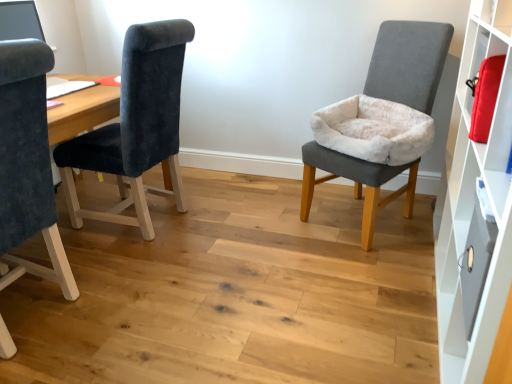
What do you see at coordinates (476, 264) in the screenshot? I see `metallic gray drawer at right` at bounding box center [476, 264].

I want to click on velvet dark blue chair at left, the third chair viewed from the right, so click(27, 164).

What do you see at coordinates (473, 201) in the screenshot?
I see `white matte cabinet at right` at bounding box center [473, 201].

The width and height of the screenshot is (512, 384). What do you see at coordinates (408, 62) in the screenshot?
I see `velvet gray chair at right, the first chair viewed from the right` at bounding box center [408, 62].

Measure the distance between point [429,83] and camera.

7.08 feet.

What is the approximate width of velvet dark blue chair at left, the second chair positioned from the left?

26.82 inches.

The height and width of the screenshot is (384, 512). In order to click on metallic gray drawer at right in this screenshot , I will do `click(476, 264)`.

Who is bigger, velvet gray chair at right, acting as the third chair starting from the left, or white matte cabinet at right?

white matte cabinet at right is bigger.

Can you tell me how much velvet gray chair at right, acting as the third chair starting from the left, and white matte cabinet at right differ in facing direction?

58 degrees.

Would you say white matte cabinet at right is part of velvet gray chair at right, acting as the third chair starting from the left,'s contents?

No, velvet gray chair at right, acting as the third chair starting from the left, does not contain white matte cabinet at right.

Is velvet dark blue chair at left, the third chair viewed from the right, next to velvet gray chair at right, the first chair viewed from the right?

velvet dark blue chair at left, the third chair viewed from the right, and velvet gray chair at right, the first chair viewed from the right, are not in contact.

Considering the points (7, 251) and (423, 53), which point is behind, point (7, 251) or point (423, 53)?

The point (423, 53) is behind.

Can you tell me how much velvet dark blue chair at left, which is the 1th chair from left to right, and velvet gray chair at right, the first chair viewed from the right, differ in facing direction?

The angle between the facing direction of velvet dark blue chair at left, which is the 1th chair from left to right, and the facing direction of velvet gray chair at right, the first chair viewed from the right, is 59.1 degrees.

Can you confirm if velvet dark blue chair at left, the third chair viewed from the right, is smaller than velvet gray chair at right, acting as the third chair starting from the left?

Indeed, velvet dark blue chair at left, the third chair viewed from the right, has a smaller size compared to velvet gray chair at right, acting as the third chair starting from the left.

Locate an element on the screen. drawer in front of the velvet dark blue chair at left, the second chair positioned from the left is located at coordinates (476, 264).

Is metallic gray drawer at right at the right side of velvet dark blue chair at left, positioned as the second chair in right-to-left order?

Yes.

Considering the sizes of metallic gray drawer at right and velvet dark blue chair at left, positioned as the second chair in right-to-left order, in the image, is metallic gray drawer at right taller or shorter than velvet dark blue chair at left, positioned as the second chair in right-to-left order,?

Considering their sizes, metallic gray drawer at right has less height than velvet dark blue chair at left, positioned as the second chair in right-to-left order.

Considering the sizes of objects metallic gray drawer at right and velvet dark blue chair at left, the second chair positioned from the left, in the image provided, who is wider, metallic gray drawer at right or velvet dark blue chair at left, the second chair positioned from the left,?

Wider between the two is velvet dark blue chair at left, the second chair positioned from the left.

Based on the photo, considering the sizes of objects velvet dark blue chair at left, which is the 1th chair from left to right, and velvet dark blue chair at left, positioned as the second chair in right-to-left order, in the image provided, who is smaller, velvet dark blue chair at left, which is the 1th chair from left to right, or velvet dark blue chair at left, positioned as the second chair in right-to-left order,?

velvet dark blue chair at left, positioned as the second chair in right-to-left order.

Is velvet dark blue chair at left, the third chair viewed from the right, not close to velvet dark blue chair at left, the second chair positioned from the left?

No, velvet dark blue chair at left, the third chair viewed from the right, is not far away from velvet dark blue chair at left, the second chair positioned from the left.

Does point (31, 85) come farther from viewer compared to point (161, 157)?

No, (31, 85) is in front of (161, 157).

Which object is closer to the camera taking this photo, velvet dark blue chair at left, the third chair viewed from the right, or velvet dark blue chair at left, the second chair positioned from the left?

velvet dark blue chair at left, the third chair viewed from the right.

The height and width of the screenshot is (384, 512). What are the coordinates of `chair on the left of velvet dark blue chair at left, the second chair positioned from the left` in the screenshot? It's located at (27, 164).

Is velvet dark blue chair at left, the second chair positioned from the left, in contact with velvet dark blue chair at left, which is the 1th chair from left to right?

No.

Is velvet dark blue chair at left, which is the 1th chair from left to right, at the back of velvet dark blue chair at left, positioned as the second chair in right-to-left order?

That's not correct — velvet dark blue chair at left, positioned as the second chair in right-to-left order, is not looking away from velvet dark blue chair at left, which is the 1th chair from left to right.

Measure the distance between velvet dark blue chair at left, the second chair positioned from the left, and velvet dark blue chair at left, the third chair viewed from the right.

They are 22.84 inches apart.

Considering the positions of objects velvet gray chair at right, acting as the third chair starting from the left, and velvet dark blue chair at left, the third chair viewed from the right, in the image provided, who is in front, velvet gray chair at right, acting as the third chair starting from the left, or velvet dark blue chair at left, the third chair viewed from the right,?

velvet dark blue chair at left, the third chair viewed from the right, is closer to the camera.

Considering the relative sizes of velvet gray chair at right, acting as the third chair starting from the left, and velvet dark blue chair at left, the third chair viewed from the right, in the image provided, is velvet gray chair at right, acting as the third chair starting from the left, taller than velvet dark blue chair at left, the third chair viewed from the right,?

Incorrect, the height of velvet gray chair at right, acting as the third chair starting from the left, is not larger of that of velvet dark blue chair at left, the third chair viewed from the right.

Is velvet gray chair at right, the first chair viewed from the right, touching velvet dark blue chair at left, the third chair viewed from the right?

No, velvet gray chair at right, the first chair viewed from the right, is not with velvet dark blue chair at left, the third chair viewed from the right.

Looking at this image, between velvet gray chair at right, acting as the third chair starting from the left, and velvet dark blue chair at left, the third chair viewed from the right, which one has larger size?

With larger size is velvet gray chair at right, acting as the third chair starting from the left.

Is velvet dark blue chair at left, the second chair positioned from the left, beside metallic gray drawer at right?

velvet dark blue chair at left, the second chair positioned from the left, is not next to metallic gray drawer at right, and they're not touching.

Does velvet dark blue chair at left, the second chair positioned from the left, turn towards metallic gray drawer at right?

No, velvet dark blue chair at left, the second chair positioned from the left, is not oriented towards metallic gray drawer at right.

Considering the sizes of velvet dark blue chair at left, the second chair positioned from the left, and metallic gray drawer at right in the image, is velvet dark blue chair at left, the second chair positioned from the left, wider or thinner than metallic gray drawer at right?

In the image, velvet dark blue chair at left, the second chair positioned from the left, appears to be wider than metallic gray drawer at right.

Measure the distance from velvet dark blue chair at left, positioned as the second chair in right-to-left order, to metallic gray drawer at right.

velvet dark blue chair at left, positioned as the second chair in right-to-left order, and metallic gray drawer at right are 5.39 feet apart from each other.

Identify the location of cabinet in front of the velvet gray chair at right, acting as the third chair starting from the left. The width and height of the screenshot is (512, 384). (473, 201).

Identify the location of chair below the velvet gray chair at right, the first chair viewed from the right (from the image's perspective). (27, 164).

Looking at the image, which one is located closer to velvet gray chair at right, the first chair viewed from the right, velvet dark blue chair at left, the third chair viewed from the right, or metallic gray drawer at right?

metallic gray drawer at right.

From the image, which object appears to be nearer to velvet dark blue chair at left, which is the 1th chair from left to right, velvet dark blue chair at left, the second chair positioned from the left, or metallic gray drawer at right?

velvet dark blue chair at left, the second chair positioned from the left.

Estimate the real-world distances between objects in this image. Which object is further from velvet dark blue chair at left, the third chair viewed from the right, white matte cabinet at right or velvet gray chair at right, acting as the third chair starting from the left?

Among the two, velvet gray chair at right, acting as the third chair starting from the left, is located further to velvet dark blue chair at left, the third chair viewed from the right.

Which object lies nearer to the anchor point white matte cabinet at right, metallic gray drawer at right or velvet gray chair at right, acting as the third chair starting from the left?

The object closer to white matte cabinet at right is metallic gray drawer at right.

Considering their positions, is velvet gray chair at right, acting as the third chair starting from the left, positioned further to white matte cabinet at right than velvet dark blue chair at left, positioned as the second chair in right-to-left order?

velvet dark blue chair at left, positioned as the second chair in right-to-left order, is positioned further to the anchor white matte cabinet at right.

When comparing their distances from white matte cabinet at right, does velvet dark blue chair at left, which is the 1th chair from left to right, or velvet gray chair at right, acting as the third chair starting from the left, seem further?

velvet dark blue chair at left, which is the 1th chair from left to right, is further to white matte cabinet at right.

Which object lies nearer to the anchor point velvet dark blue chair at left, positioned as the second chair in right-to-left order, velvet dark blue chair at left, the third chair viewed from the right, or white matte cabinet at right?

velvet dark blue chair at left, the third chair viewed from the right, is positioned closer to the anchor velvet dark blue chair at left, positioned as the second chair in right-to-left order.

When comparing their distances from white matte cabinet at right, does velvet gray chair at right, the first chair viewed from the right, or metallic gray drawer at right seem further?

The object further to white matte cabinet at right is velvet gray chair at right, the first chair viewed from the right.

Locate an element on the screen. The width and height of the screenshot is (512, 384). drawer between velvet dark blue chair at left, positioned as the second chair in right-to-left order, and white matte cabinet at right is located at coordinates (476, 264).

You are a GUI agent. You are given a task and a screenshot of the screen. Output one action in this format:
    pyautogui.click(x=<x>, y=<y>)
    Task: Click on the chair located between velvet dark blue chair at left, which is the 1th chair from left to right, and velvet gray chair at right, the first chair viewed from the right, in the left-right direction
    The height and width of the screenshot is (384, 512).
    Given the screenshot: What is the action you would take?
    pyautogui.click(x=136, y=126)

Where is `chair between velvet dark blue chair at left, positioned as the second chair in right-to-left order, and white matte cabinet at right`? The width and height of the screenshot is (512, 384). chair between velvet dark blue chair at left, positioned as the second chair in right-to-left order, and white matte cabinet at right is located at coordinates (408, 62).

The image size is (512, 384). Find the location of `chair between velvet dark blue chair at left, positioned as the second chair in right-to-left order, and metallic gray drawer at right, in the horizontal direction`. chair between velvet dark blue chair at left, positioned as the second chair in right-to-left order, and metallic gray drawer at right, in the horizontal direction is located at coordinates (408, 62).